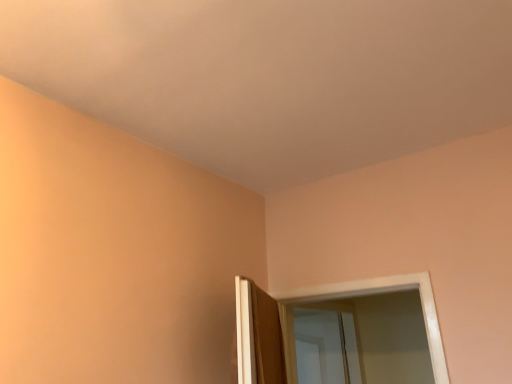
Image resolution: width=512 pixels, height=384 pixels. In order to click on brown fabric curtain at upper right in this screenshot , I will do `click(258, 336)`.

This screenshot has width=512, height=384. What do you see at coordinates (258, 336) in the screenshot?
I see `brown fabric curtain at upper right` at bounding box center [258, 336].

What is the approximate width of brown fabric curtain at upper right?

The width of brown fabric curtain at upper right is 5.53 inches.

Locate an element on the screen. The width and height of the screenshot is (512, 384). brown fabric curtain at upper right is located at coordinates (258, 336).